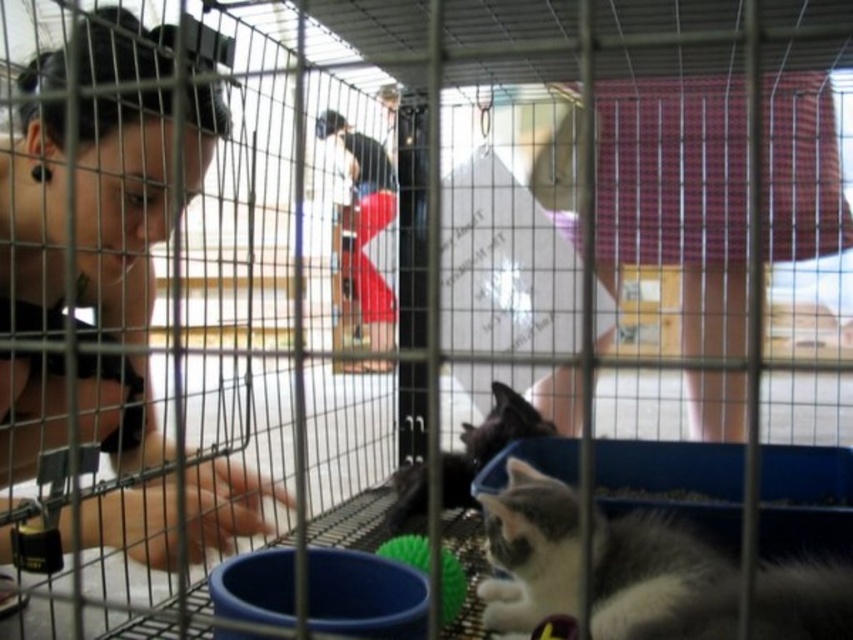
Question: Does matte black hair at left have a smaller size compared to gray and white fur cat at lower right?

Choices:
 (A) no
 (B) yes

Answer: (A)

Question: Estimate the real-world distances between objects in this image. Which object is farther from the gray and white fur cat at lower right?

Choices:
 (A) matte black hair at left
 (B) black fur cat at lower center

Answer: (A)

Question: Among these objects, which one is farthest from the camera?

Choices:
 (A) black fur cat at lower center
 (B) matte black hair at left

Answer: (A)

Question: Does matte black hair at left come behind gray and white fur cat at lower right?

Choices:
 (A) no
 (B) yes

Answer: (A)

Question: Can you confirm if matte black hair at left is smaller than black fur cat at lower center?

Choices:
 (A) yes
 (B) no

Answer: (B)

Question: Among these objects, which one is farthest from the camera?

Choices:
 (A) matte black hair at left
 (B) black fur cat at lower center

Answer: (B)